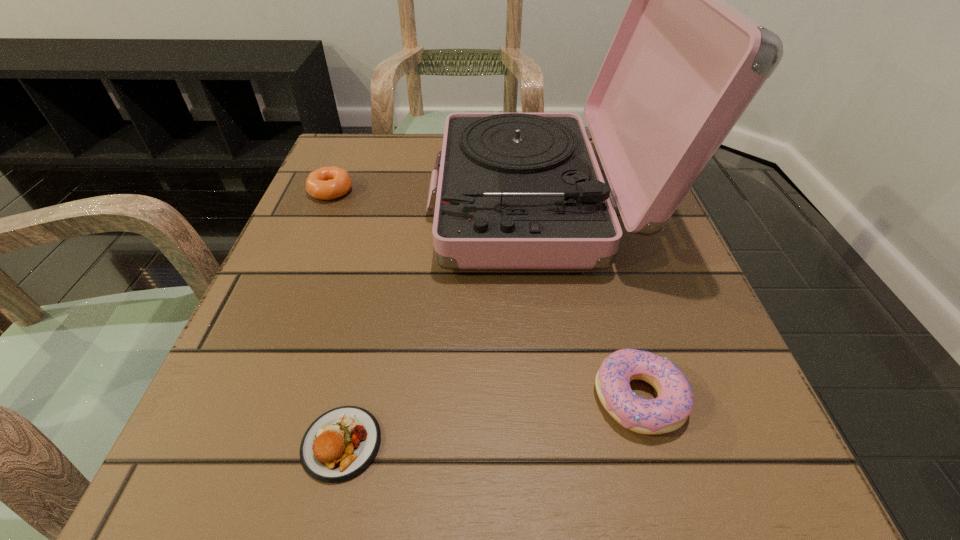
Locate an element on the screen. This screenshot has width=960, height=540. vacant space located 0.110m on the right of the farther doughnut is located at coordinates (406, 191).

The height and width of the screenshot is (540, 960). Identify the location of free space located 0.240m on the back of the third object from right to left. 379,276.

Locate an element on the screen. This screenshot has height=540, width=960. record player that is at the far edge is located at coordinates (515, 190).

The height and width of the screenshot is (540, 960). Identify the location of doughnut that is at the far edge. (327, 183).

Locate an element on the screen. This screenshot has height=540, width=960. doughnut located at the near edge is located at coordinates point(669,411).

Identify the location of patty (food) at the near edge. The height and width of the screenshot is (540, 960). (340, 444).

Find the location of a particular element. The width and height of the screenshot is (960, 540). doughnut at the left edge is located at coordinates (327, 183).

Identify the location of patty (food) located at the left edge. (340, 444).

Where is `record player situated at the right edge`? Image resolution: width=960 pixels, height=540 pixels. record player situated at the right edge is located at coordinates (515, 190).

You are a GUI agent. You are given a task and a screenshot of the screen. Output one action in this format:
    pyautogui.click(x=<x>, y=<y>)
    Task: Click on the doughnut positioned at the right edge
    The height and width of the screenshot is (540, 960).
    Given the screenshot: What is the action you would take?
    pyautogui.click(x=669, y=411)